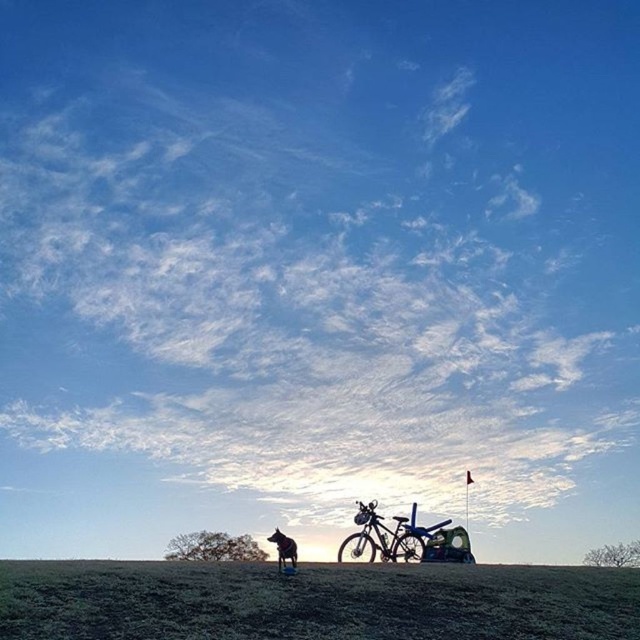
Question: Estimate the real-world distances between objects in this image. Which object is closer to the green grassy field at lower center?

Choices:
 (A) shiny metallic bicycle at center
 (B) shiny black dog at lower center

Answer: (B)

Question: Which point is closer to the camera?

Choices:
 (A) shiny black dog at lower center
 (B) green grassy field at lower center

Answer: (B)

Question: In this image, where is green grassy field at lower center located relative to shiny black dog at lower center?

Choices:
 (A) right
 (B) left

Answer: (A)

Question: Can you confirm if shiny metallic bicycle at center is bigger than shiny black dog at lower center?

Choices:
 (A) yes
 (B) no

Answer: (A)

Question: Based on their relative distances, which object is farther from the green grassy field at lower center?

Choices:
 (A) shiny metallic bicycle at center
 (B) shiny black dog at lower center

Answer: (A)

Question: Can you confirm if green grassy field at lower center is wider than shiny metallic bicycle at center?

Choices:
 (A) yes
 (B) no

Answer: (A)